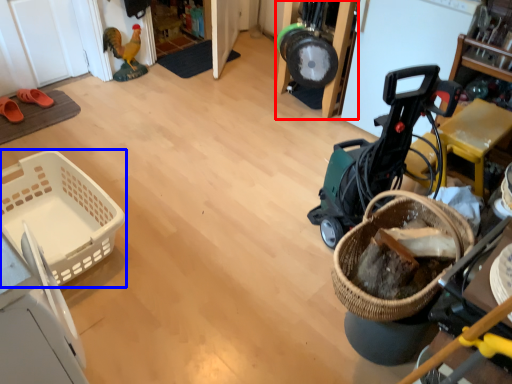
Question: Which point is closer to the camera, furniture (highlighted by a red box) or basket (highlighted by a blue box)?

Choices:
 (A) furniture
 (B) basket

Answer: (B)